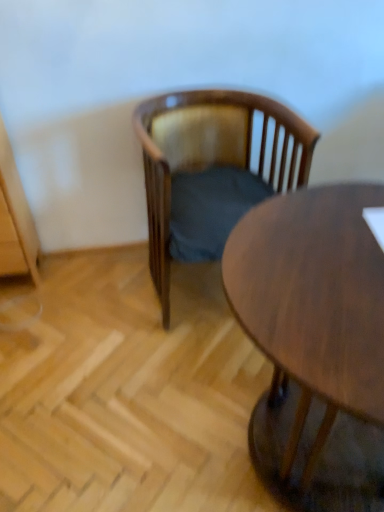
Question: Is point (157, 251) positioned closer to the camera than point (352, 263)?

Choices:
 (A) closer
 (B) farther

Answer: (B)

Question: From a real-world perspective, is wooden chair with cushion at center above or below wooden round table at center?

Choices:
 (A) above
 (B) below

Answer: (A)

Question: In the image, is wooden chair with cushion at center positioned in front of or behind wooden round table at center?

Choices:
 (A) behind
 (B) front

Answer: (A)

Question: Considering the positions of wooden round table at center and wooden chair with cushion at center in the image, is wooden round table at center bigger or smaller than wooden chair with cushion at center?

Choices:
 (A) small
 (B) big

Answer: (B)

Question: Based on their positions, is wooden round table at center located to the left or right of wooden chair with cushion at center?

Choices:
 (A) right
 (B) left

Answer: (A)

Question: In terms of height, does wooden round table at center look taller or shorter compared to wooden chair with cushion at center?

Choices:
 (A) short
 (B) tall

Answer: (B)

Question: Is wooden round table at center inside or outside of wooden chair with cushion at center?

Choices:
 (A) inside
 (B) outside

Answer: (B)